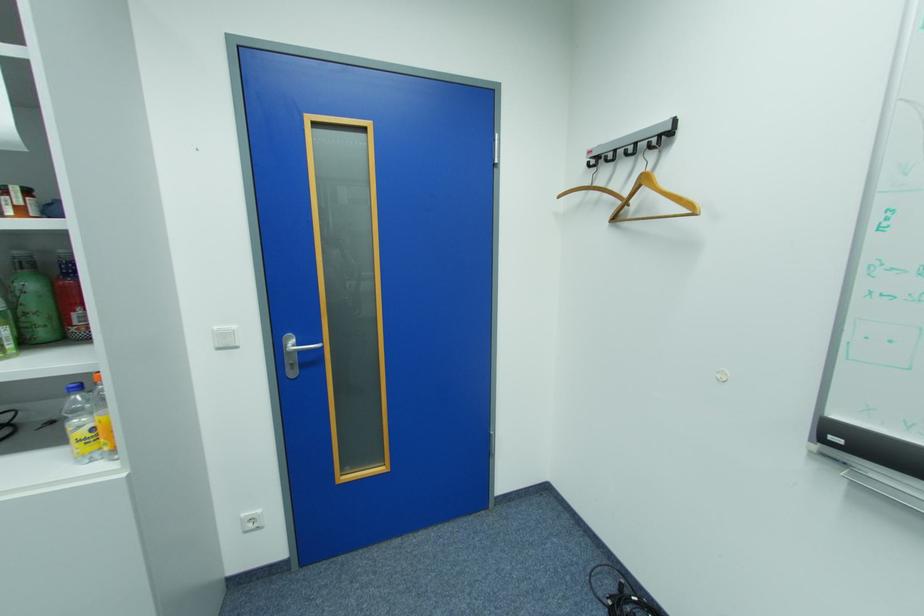
Locate an element on the screen. The image size is (924, 616). red glass bottle is located at coordinates (70, 299).